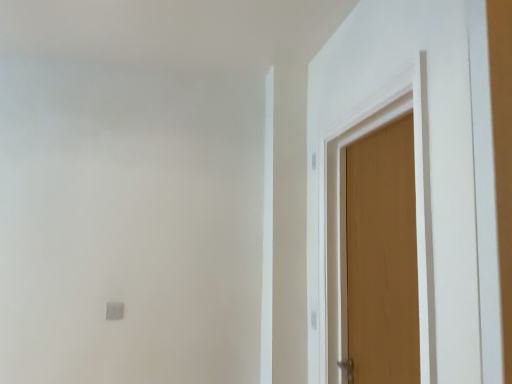
Question: Is wooden door at right, acting as the 2th door starting from the left, bigger than wooden door at right, the 1th door from the left?

Choices:
 (A) no
 (B) yes

Answer: (B)

Question: From the image's perspective, would you say wooden door at right, which ranks as the 1th door in right-to-left order, is positioned over wooden door at right, the 2th door positioned from the right?

Choices:
 (A) yes
 (B) no

Answer: (B)

Question: Does wooden door at right, which ranks as the 1th door in right-to-left order, appear on the right side of wooden door at right, the 2th door positioned from the right?

Choices:
 (A) yes
 (B) no

Answer: (A)

Question: From a real-world perspective, is wooden door at right, acting as the 2th door starting from the left, on top of wooden door at right, the 1th door from the left?

Choices:
 (A) no
 (B) yes

Answer: (A)

Question: Are wooden door at right, acting as the 2th door starting from the left, and wooden door at right, the 1th door from the left, far apart?

Choices:
 (A) no
 (B) yes

Answer: (A)

Question: Is wooden door at right, which ranks as the 1th door in right-to-left order, facing away from wooden door at right, the 2th door positioned from the right?

Choices:
 (A) no
 (B) yes

Answer: (B)

Question: Is wooden door at right, the 1th door from the left, next to wooden door at right, acting as the 2th door starting from the left, and touching it?

Choices:
 (A) no
 (B) yes

Answer: (A)

Question: Can you confirm if wooden door at right, the 2th door positioned from the right, is positioned to the left of wooden door at right, which ranks as the 1th door in right-to-left order?

Choices:
 (A) yes
 (B) no

Answer: (A)

Question: Is wooden door at right, the 1th door from the left, positioned with its back to wooden door at right, acting as the 2th door starting from the left?

Choices:
 (A) no
 (B) yes

Answer: (B)

Question: Is wooden door at right, the 2th door positioned from the right, in front of wooden door at right, acting as the 2th door starting from the left?

Choices:
 (A) no
 (B) yes

Answer: (B)

Question: From a real-world perspective, is wooden door at right, the 2th door positioned from the right, under wooden door at right, which ranks as the 1th door in right-to-left order?

Choices:
 (A) no
 (B) yes

Answer: (A)

Question: Is wooden door at right, the 2th door positioned from the right, further to the viewer compared to wooden door at right, which ranks as the 1th door in right-to-left order?

Choices:
 (A) no
 (B) yes

Answer: (A)

Question: Considering the positions of point (322, 240) and point (411, 183), is point (322, 240) closer or farther from the camera than point (411, 183)?

Choices:
 (A) closer
 (B) farther

Answer: (B)